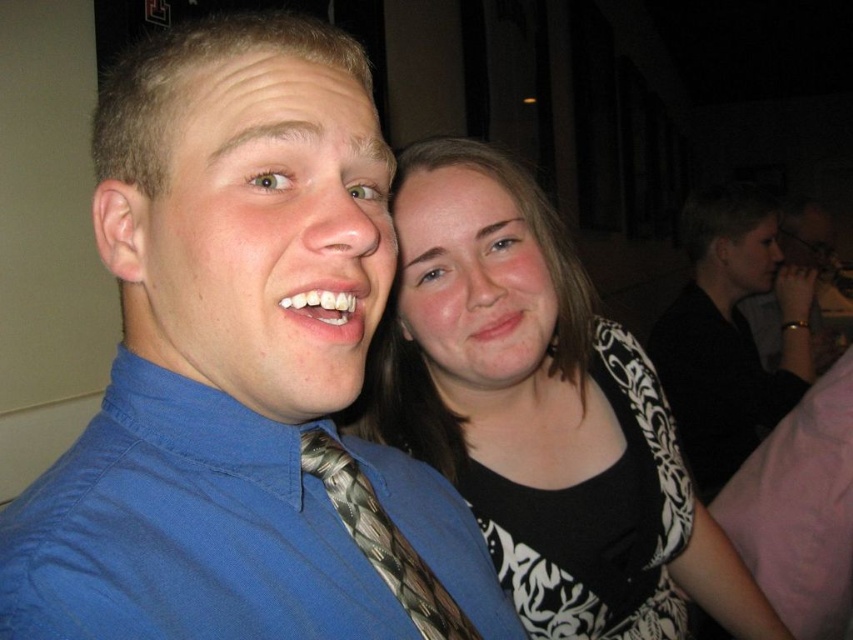
You are a photographer adjusting the lighting for a portrait. The subject has a matte black face at center. Where should you position the light to avoid harsh shadows? Please provide coordinates based on the image grid system where the top left corner is the origin point.

The matte black face at center is located at coordinates point (473, 280). To avoid harsh shadows, position the light slightly to the left of the matte black face at center, around the point (473, 224).

Consider the image. You are a photographer trying to place a small sticker exactly at the point marked as point (x=263, y=236) on the image. According to the scene description, where should you place the sticker?

The point (x=263, y=236) is on the blue fabric face at center, so you should place the sticker on the blue fabric face at center.

You are a photographer adjusting the lighting in the studio. You need to place a spotlight to highlight the black and white patterned dress at upper right. Given that the spotlight can only illuminate an area within a 0.5 unit radius from its center, would placing it at point (540, 412) be effective?

Yes, placing the spotlight at point (540, 412) would effectively illuminate the black and white patterned dress at upper right since the point directly indicates its location.